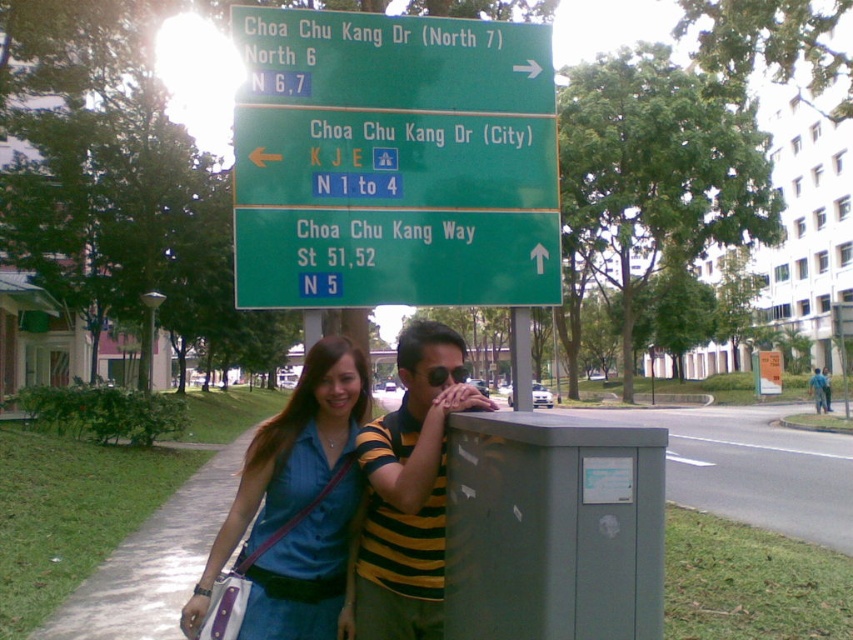
You are a pedestrian trying to read the signs on the street. There are two signs present, the green matte sign at center and the green plastic sign at upper center. Which one is located lower?

The green matte sign at center is located below the green plastic sign at upper center, so the green matte sign at center is the lower one.

You are a pedestrian standing on the street and see the denim shirt at center and the green matte sign at upper center. Which object is taller?

The denim shirt at center is much taller than the green matte sign at upper center.